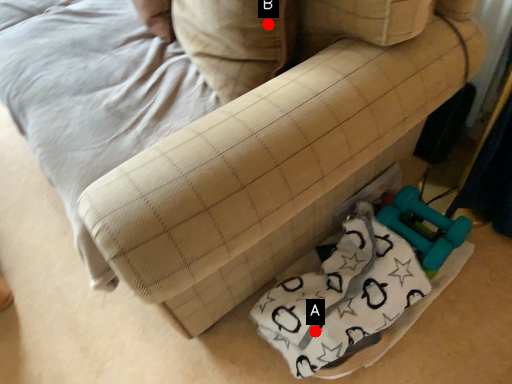
Question: Two points are circled on the image, labeled by A and B beside each circle. Which of the following is the closest to the observer?

Choices:
 (A) A is closer
 (B) B is closer

Answer: (B)